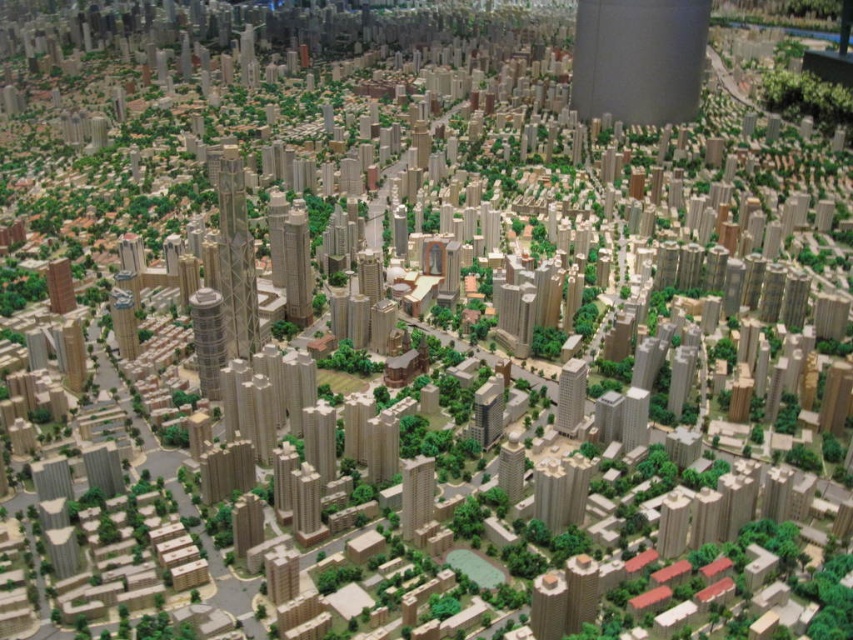
Can you confirm if shiny silver skyscraper at center-left is smaller than matte beige building at center?

Incorrect, shiny silver skyscraper at center-left is not smaller in size than matte beige building at center.

Is shiny silver skyscraper at center-left positioned behind matte beige building at center?

That is True.

Who is more distant from viewer, (207, 397) or (405, 522)?

The point (207, 397) is more distant.

Find the location of a particular element. The width and height of the screenshot is (853, 640). shiny silver skyscraper at center-left is located at coordinates (207, 339).

Is smooth gray tower at upper right above shiny silver skyscraper at center-left?

Indeed, smooth gray tower at upper right is positioned over shiny silver skyscraper at center-left.

Does point (592, 51) lie in front of point (190, 314)?

No, it is behind (190, 314).

The image size is (853, 640). Describe the element at coordinates (637, 60) in the screenshot. I see `smooth gray tower at upper right` at that location.

The image size is (853, 640). What are the coordinates of `smooth gray tower at upper right` in the screenshot? It's located at (637, 60).

Who is shorter, shiny silver skyscraper at center-left or smooth beige skyscraper at center-left?

smooth beige skyscraper at center-left is shorter.

Which is more to the right, shiny silver skyscraper at center-left or smooth beige skyscraper at center-left?

Positioned to the right is shiny silver skyscraper at center-left.

The height and width of the screenshot is (640, 853). I want to click on shiny silver skyscraper at center-left, so click(207, 339).